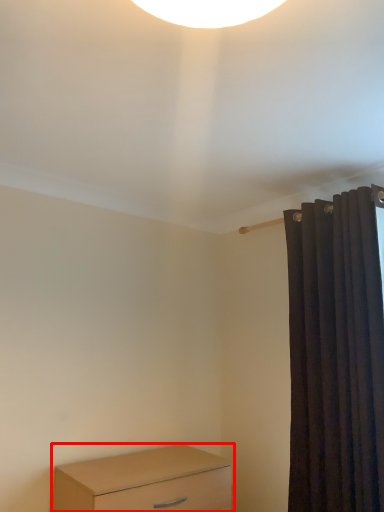
Question: From the image's perspective, what is the correct spatial relationship of chest of drawers (annotated by the red box) in relation to curtain?

Choices:
 (A) above
 (B) below

Answer: (B)